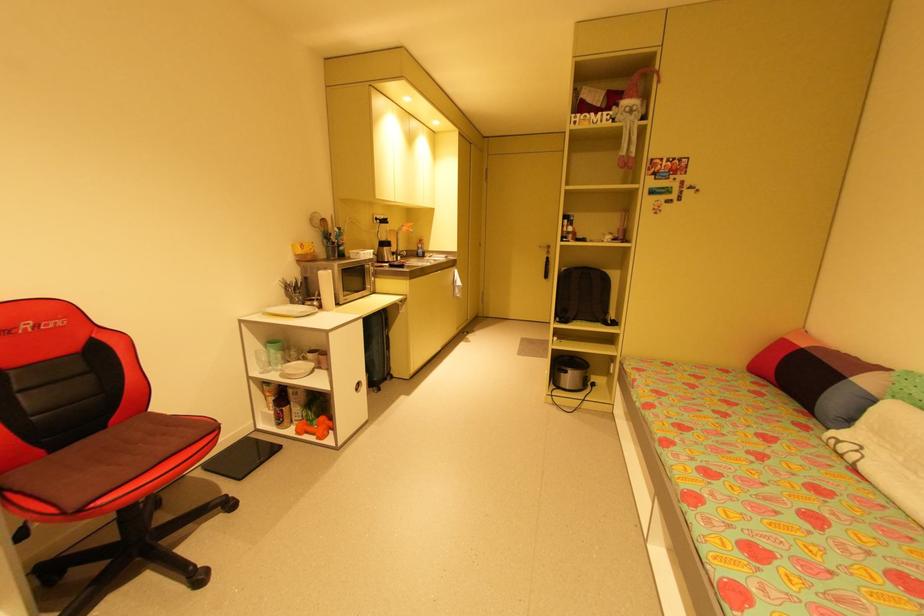
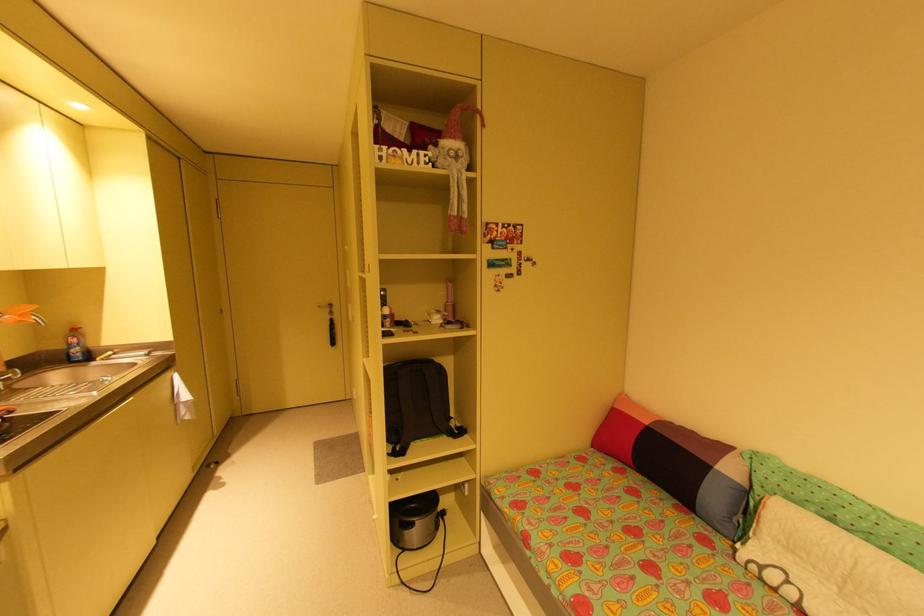
The point at (x=412, y=227) is marked in the first image. Where is the corresponding point in the second image?

(25, 315)